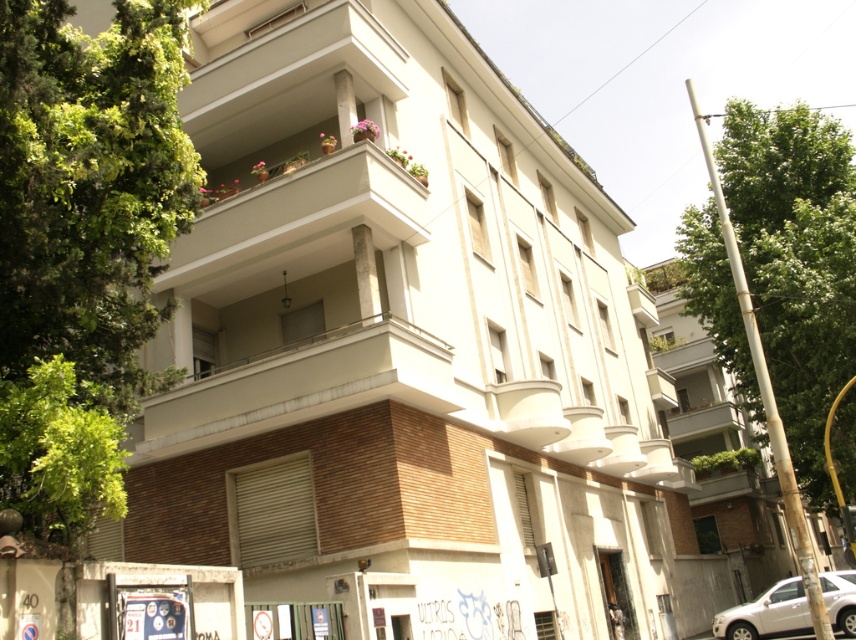
Question: Does white concrete balcony at upper center have a greater width compared to white matte car at lower right?

Choices:
 (A) no
 (B) yes

Answer: (B)

Question: Among these objects, which one is nearest to the camera?

Choices:
 (A) green leafy tree at right
 (B) white matte car at lower right

Answer: (B)

Question: Does white concrete balcony at upper center come behind white matte car at lower right?

Choices:
 (A) yes
 (B) no

Answer: (B)

Question: Can you confirm if green leafy tree at right is positioned to the left of white concrete balcony at upper center?

Choices:
 (A) no
 (B) yes

Answer: (A)

Question: Which object appears farthest from the camera in this image?

Choices:
 (A) green leafy tree at right
 (B) white matte car at lower right
 (C) white concrete balcony at upper center

Answer: (A)

Question: Which object is closer to the camera taking this photo?

Choices:
 (A) green leafy tree at right
 (B) white matte car at lower right

Answer: (B)